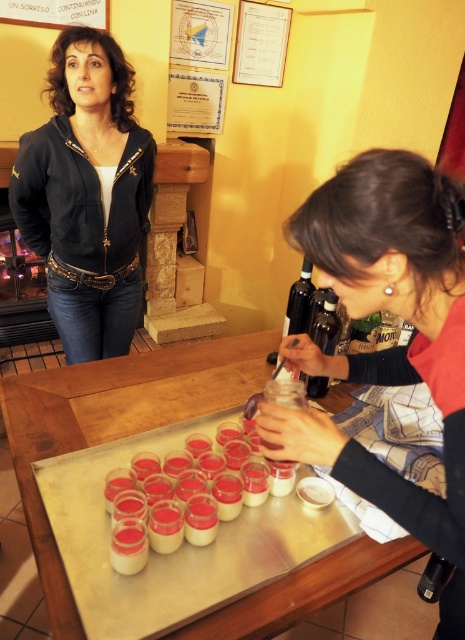
You are planning to place the black leather jacket at upper left and the white creamy pudding at center onto a shelf that can only hold items with a combined size of 1.5 times the size of the smaller item. Can both items fit together on the shelf?

The black leather jacket at upper left is larger than the white creamy pudding at center. Since the shelf can hold items up to 1.5 times the size of the smaller item, the combined size of both items exceeds the limit. Therefore, they cannot fit together on the shelf.

Looking at this image, you are a guest entering the room and need to place your black leather jacket at upper left on a surface. Can you put it on the wooden table at center without it dragging on the floor?

The wooden table at center has a lesser height compared to black leather jacket at upper left, so placing the jacket on the table would require folding it to avoid dragging since the table is shorter than the jacket.